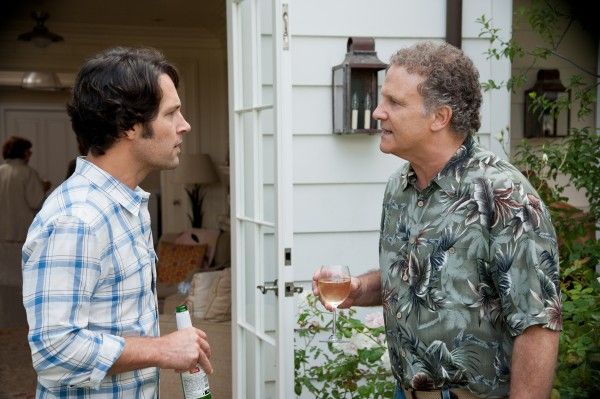
Locate an element on the screen. The height and width of the screenshot is (399, 600). lamp shade is located at coordinates (194, 175).